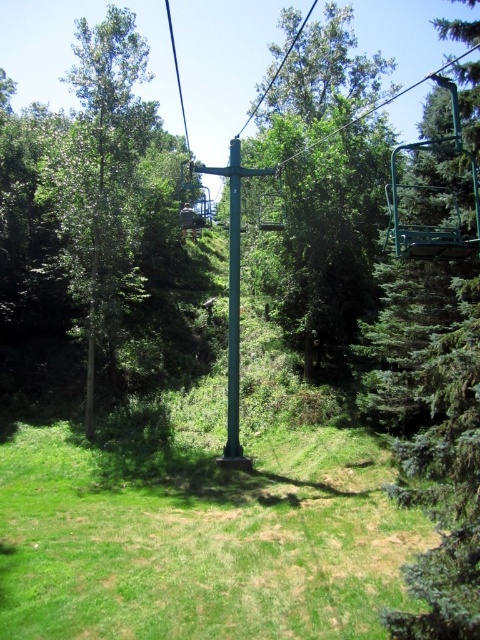
You are standing in the forest and see the green grassy at center and the green leafy tree at center. Which one is closer to the ground?

The green grassy at center is located below green leafy tree at center, so the green grassy at center is closer to the ground.

You are standing at the point marked as point [201,541] in the image. What is the closest object to you in the scene?

The closest object to you at point [201,541] is the green grassy at center, as the point corresponds directly to it.